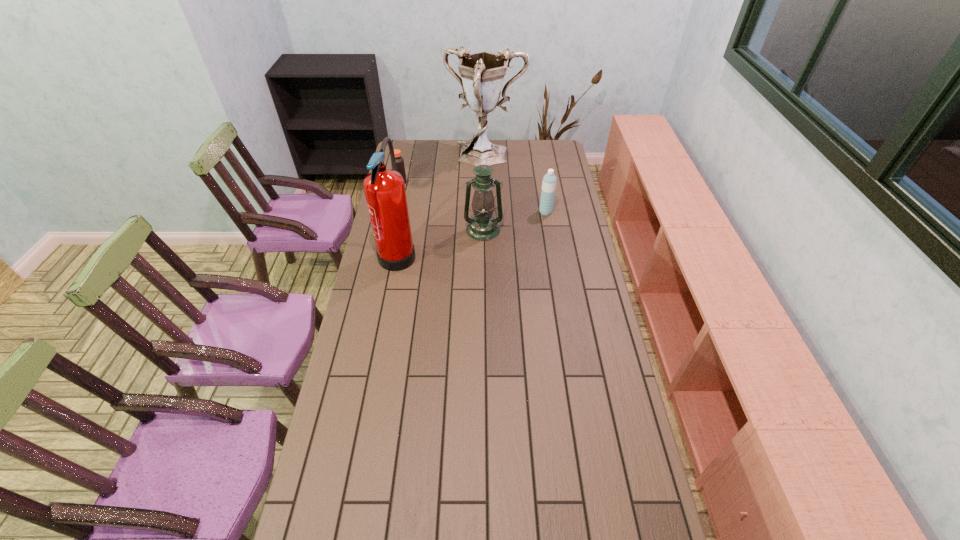
Where is `free spot located on the front of the fourth tallest object`? The image size is (960, 540). free spot located on the front of the fourth tallest object is located at coordinates (555, 269).

Find the location of a particular element. Image resolution: width=960 pixels, height=540 pixels. vacant region located 0.380m on the right of the fourth nearest object is located at coordinates (482, 183).

Image resolution: width=960 pixels, height=540 pixels. Identify the location of object that is at the far edge. (482, 73).

Locate an element on the screen. This screenshot has width=960, height=540. fire extinguisher that is at the left edge is located at coordinates (384, 189).

You are a GUI agent. You are given a task and a screenshot of the screen. Output one action in this format:
    pyautogui.click(x=<x>, y=<y>)
    Task: Click on the vinegar present at the left edge
    
    Given the screenshot: What is the action you would take?
    pyautogui.click(x=400, y=167)

You are a GUI agent. You are given a task and a screenshot of the screen. Output one action in this format:
    pyautogui.click(x=<x>, y=<y>)
    Task: Click on the object that is at the right edge
    The width and height of the screenshot is (960, 540).
    Given the screenshot: What is the action you would take?
    pyautogui.click(x=549, y=181)

Find the location of a particular element. This screenshot has height=540, width=960. vacant space at the far edge is located at coordinates (447, 158).

Image resolution: width=960 pixels, height=540 pixels. I want to click on free region at the left edge of the desktop, so [369, 292].

The width and height of the screenshot is (960, 540). In the image, there is a desktop. Identify the location of free space at the right edge. 566,207.

Where is `free location at the far left corner`? This screenshot has height=540, width=960. free location at the far left corner is located at coordinates (411, 156).